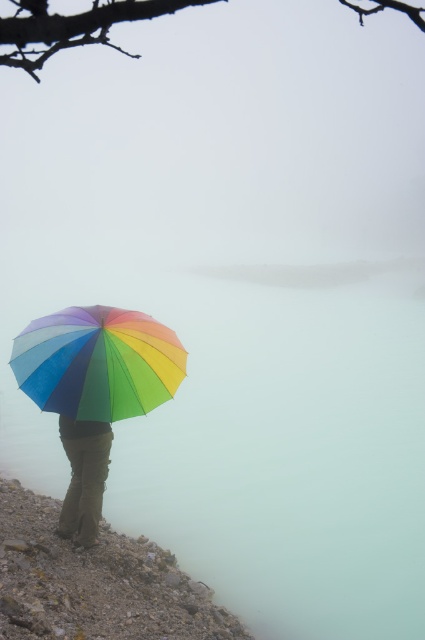
Which of these two, rough stone hillside at lower left or rainbow fabric umbrella at center, stands taller?

Standing taller between the two is rainbow fabric umbrella at center.

Between rough stone hillside at lower left and rainbow fabric umbrella at center, which one has less height?

With less height is rough stone hillside at lower left.

Where is `rough stone hillside at lower left`? This screenshot has width=425, height=640. rough stone hillside at lower left is located at coordinates (95, 582).

The image size is (425, 640). I want to click on rough stone hillside at lower left, so click(x=95, y=582).

Does point (102, 636) lie in front of point (98, 481)?

Yes.

Does rough stone hillside at lower left have a greater height compared to matte green pants at lower left?

Incorrect, rough stone hillside at lower left's height is not larger of matte green pants at lower left's.

Find the location of `rough stone hillside at lower left`. rough stone hillside at lower left is located at coordinates (95, 582).

At what (x,y) coordinates should I click in order to perform the action: click on rough stone hillside at lower left. Please return your answer as a coordinate pair (x, y). The height and width of the screenshot is (640, 425). Looking at the image, I should click on (95, 582).

Based on the photo, does translucent misty water at lower center have a smaller size compared to rough stone hillside at lower left?

No.

Is translucent misty water at lower center to the left of rough stone hillside at lower left from the viewer's perspective?

In fact, translucent misty water at lower center is to the right of rough stone hillside at lower left.

The width and height of the screenshot is (425, 640). Describe the element at coordinates (265, 438) in the screenshot. I see `translucent misty water at lower center` at that location.

The width and height of the screenshot is (425, 640). Find the location of `translucent misty water at lower center`. translucent misty water at lower center is located at coordinates (265, 438).